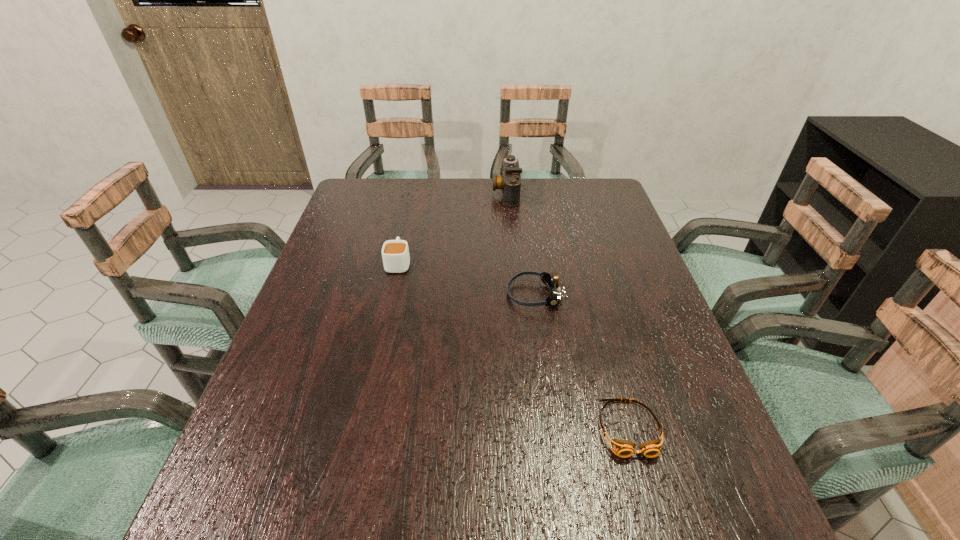
In order to click on vacant area that lies between the leftmost object and the nearest object in this screenshot , I will do pos(514,346).

Where is `blank region between the taller goggles and the shortest object`? This screenshot has width=960, height=540. blank region between the taller goggles and the shortest object is located at coordinates (582, 361).

Find the location of a particular element. This screenshot has height=540, width=960. free area in between the farthest object and the second shortest object is located at coordinates (520, 244).

Locate an element on the screen. free space between the rightmost object and the second farthest object is located at coordinates (514, 346).

Locate an element on the screen. The width and height of the screenshot is (960, 540). free spot between the farther goggles and the nearer goggles is located at coordinates (582, 361).

Locate an element on the screen. The image size is (960, 540). object that is the closest one to the camera is located at coordinates (395, 253).

In order to click on object that is the nearest to the nearer goggles in this screenshot , I will do `click(551, 281)`.